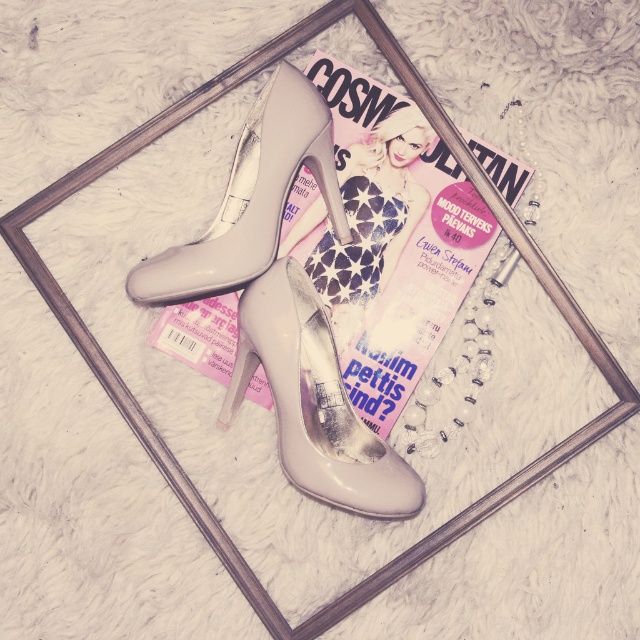
Where is `matte pink magazine at center`? matte pink magazine at center is located at coordinates (392, 241).

Image resolution: width=640 pixels, height=640 pixels. Describe the element at coordinates (392, 241) in the screenshot. I see `matte pink magazine at center` at that location.

Find the location of `matte pink magazine at center`. matte pink magazine at center is located at coordinates (392, 241).

Is pearly white high-heeled shoe at center above matte plastic barbie at center?

Actually, pearly white high-heeled shoe at center is below matte plastic barbie at center.

Measure the distance between pearly white high-heeled shoe at center and camera.

They are 1.07 meters apart.

Measure the distance between point (x=285, y=356) and camera.

3.57 feet

This screenshot has width=640, height=640. What are the coordinates of `pearly white high-heeled shoe at center` in the screenshot? It's located at (314, 400).

Is pearly white high-heeled shoe at center smaller than matte beige high-heeled shoe at center?

Yes.

Does pearly white high-heeled shoe at center come behind matte beige high-heeled shoe at center?

No, it is not.

Does point (353, 493) lie in front of point (154, 272)?

Yes, point (353, 493) is closer to viewer.

Where is `pearly white high-heeled shoe at center`? pearly white high-heeled shoe at center is located at coordinates (314, 400).